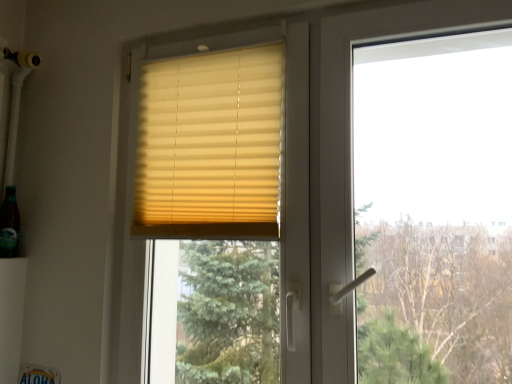
Question: Is translucent glass bottle at lower left inside or outside of beige fabric blinds at upper center?

Choices:
 (A) inside
 (B) outside

Answer: (B)

Question: In terms of height, does translucent glass bottle at lower left look taller or shorter compared to beige fabric blinds at upper center?

Choices:
 (A) tall
 (B) short

Answer: (B)

Question: Considering their positions, is translucent glass bottle at lower left located in front of or behind beige fabric blinds at upper center?

Choices:
 (A) front
 (B) behind

Answer: (B)

Question: Would you say beige fabric blinds at upper center is to the left or to the right of translucent glass bottle at lower left in the picture?

Choices:
 (A) right
 (B) left

Answer: (A)

Question: Considering the positions of beige fabric blinds at upper center and translucent glass bottle at lower left in the image, is beige fabric blinds at upper center wider or thinner than translucent glass bottle at lower left?

Choices:
 (A) wide
 (B) thin

Answer: (B)

Question: Do you think beige fabric blinds at upper center is within translucent glass bottle at lower left, or outside of it?

Choices:
 (A) outside
 (B) inside

Answer: (A)

Question: From the image's perspective, is beige fabric blinds at upper center located above or below translucent glass bottle at lower left?

Choices:
 (A) above
 (B) below

Answer: (A)